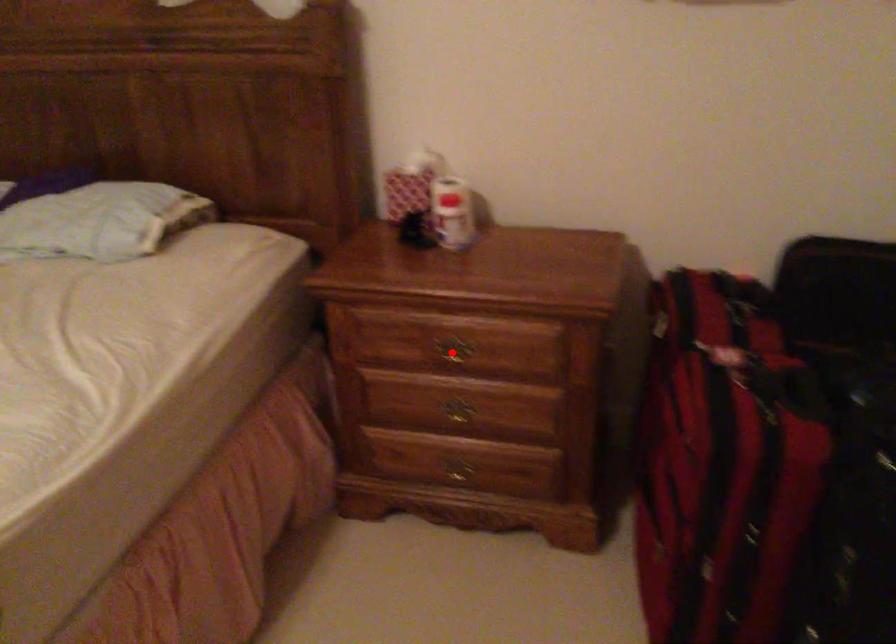
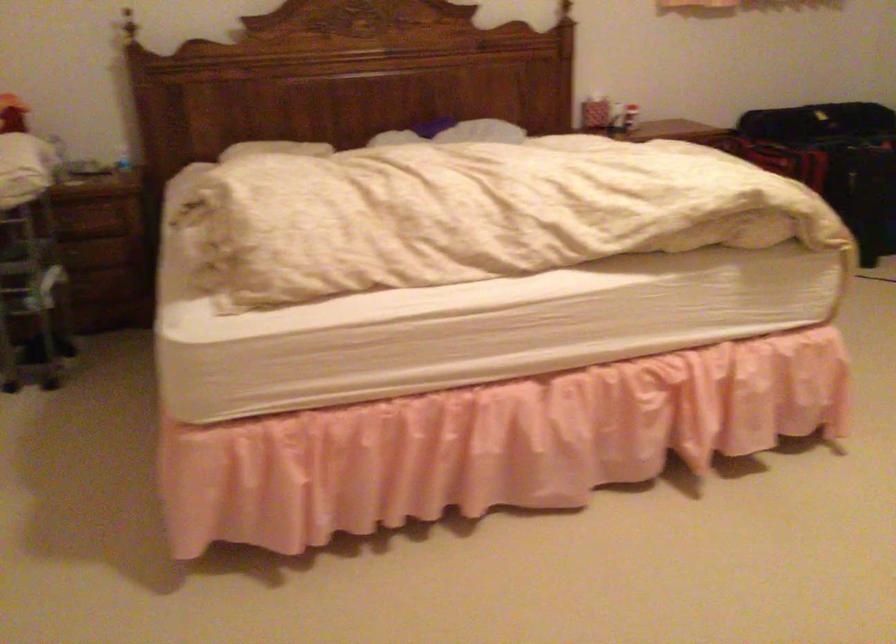
Question: I am providing you with two images of the same scene from different viewpoints. A red point is marked on the first image. At the location where the point appears in image 1, is it still visible in image 2?

Choices:
 (A) Yes
 (B) No

Answer: (B)